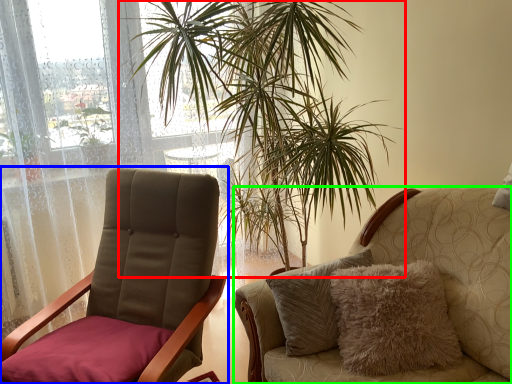
Question: Which object is positioned farthest from houseplant (highlighted by a red box)? Select from chair (highlighted by a blue box) and chair (highlighted by a green box).

Choices:
 (A) chair
 (B) chair

Answer: (B)